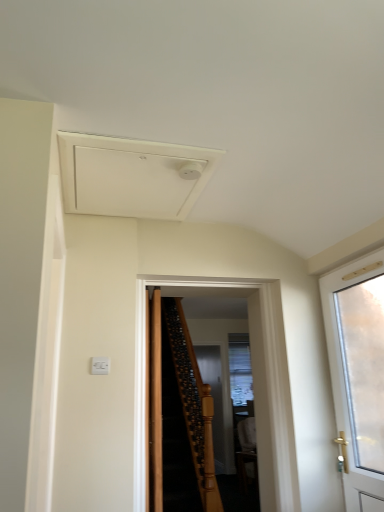
Question: Does point (360, 408) appear closer or farther from the camera than point (263, 347)?

Choices:
 (A) closer
 (B) farther

Answer: (A)

Question: From a real-world perspective, relative to brown wooden door at center, which is the second door from right to left, is white frosted glass door at right, which ranks as the third door in left-to-right order, vertically above or below?

Choices:
 (A) below
 (B) above

Answer: (B)

Question: Estimate the real-world distances between objects in this image. Which object is closer to the white matte exhaust hood at upper center?

Choices:
 (A) brown wooden door at center, the first door when ordered from left to right
 (B) clear glass screen door at center
 (C) white frosted glass door at right, which appears as the 1th door when viewed from the right
 (D) brown wooden door at center, which is counted as the 2th door, starting from the left

Answer: (D)

Question: Estimate the real-world distances between objects in this image. Which object is farther from the brown wooden door at center, which is the second door from right to left?

Choices:
 (A) white frosted glass door at right, which ranks as the third door in left-to-right order
 (B) brown wooden door at center, arranged as the third door when viewed from the right
 (C) clear glass screen door at center
 (D) white matte exhaust hood at upper center

Answer: (C)